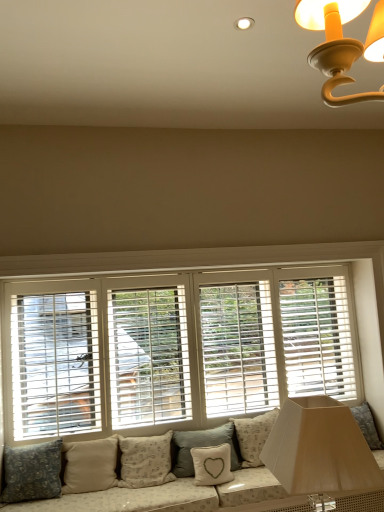
Find the location of a particular element. dark gray fabric pillow at lower left, acting as the sixth pillow starting from the right is located at coordinates (32, 472).

The image size is (384, 512). What do you see at coordinates (32, 472) in the screenshot?
I see `dark gray fabric pillow at lower left, positioned as the 1th pillow in left-to-right order` at bounding box center [32, 472].

The height and width of the screenshot is (512, 384). I want to click on white wood blinds at center, so click(176, 348).

Image resolution: width=384 pixels, height=512 pixels. What do you see at coordinates (176, 348) in the screenshot?
I see `white wood blinds at center` at bounding box center [176, 348].

What do you see at coordinates (320, 451) in the screenshot? Image resolution: width=384 pixels, height=512 pixels. I see `matte white lampshade at lower right` at bounding box center [320, 451].

The height and width of the screenshot is (512, 384). Identify the location of matte white lampshade at lower right. (320, 451).

The image size is (384, 512). Identify the location of white fabric pillow with heart design at lower center, which appears as the second pillow when viewed from the right. (212, 464).

The width and height of the screenshot is (384, 512). Describe the element at coordinates (212, 464) in the screenshot. I see `white fabric pillow with heart design at lower center, the 5th pillow positioned from the left` at that location.

Locate an element on the screen. light gray textured pillow at center, placed as the fourth pillow when sorted from left to right is located at coordinates (203, 446).

Consider the image. Is light gray textured pillow at center, arranged as the third pillow when viewed from the right, located outside fluffy white pillow at lower center, the sixth pillow in the left-to-right sequence?

light gray textured pillow at center, arranged as the third pillow when viewed from the right, is positioned outside fluffy white pillow at lower center, the sixth pillow in the left-to-right sequence.

Can you confirm if light gray textured pillow at center, placed as the fourth pillow when sorted from left to right, is smaller than fluffy white pillow at lower center, the first pillow viewed from the right?

Indeed, light gray textured pillow at center, placed as the fourth pillow when sorted from left to right, has a smaller size compared to fluffy white pillow at lower center, the first pillow viewed from the right.

From the image's perspective, between light gray textured pillow at center, placed as the fourth pillow when sorted from left to right, and fluffy white pillow at lower center, the first pillow viewed from the right, which one is located above?

fluffy white pillow at lower center, the first pillow viewed from the right, appears higher in the image.

Based on the photo, can you see light gray textured pillow at center, placed as the fourth pillow when sorted from left to right, touching fluffy white pillow at lower center, the sixth pillow in the left-to-right sequence?

No, light gray textured pillow at center, placed as the fourth pillow when sorted from left to right, is not making contact with fluffy white pillow at lower center, the sixth pillow in the left-to-right sequence.

Is matte white lampshade at lower right shorter than white wood blinds at center?

Indeed, matte white lampshade at lower right has a lesser height compared to white wood blinds at center.

Looking at the image, does matte white lampshade at lower right seem bigger or smaller compared to white wood blinds at center?

In the image, matte white lampshade at lower right appears to be smaller than white wood blinds at center.

From the image's perspective, which is below, matte white lampshade at lower right or white wood blinds at center?

white wood blinds at center.

Is point (342, 469) closer or farther from the camera than point (98, 337)?

Point (342, 469).

Considering the relative sizes of white wood blinds at center and light gray textured pillow at center, placed as the fourth pillow when sorted from left to right, in the image provided, is white wood blinds at center shorter than light gray textured pillow at center, placed as the fourth pillow when sorted from left to right,?

Incorrect, the height of white wood blinds at center does not fall short of that of light gray textured pillow at center, placed as the fourth pillow when sorted from left to right.

The image size is (384, 512). Identify the location of window above the light gray textured pillow at center, placed as the fourth pillow when sorted from left to right (from a real-world perspective). (176, 348).

Is point (334, 295) positioned before point (175, 434)?

That is False.

From the image's perspective, between white wood blinds at center and light gray textured pillow at center, arranged as the third pillow when viewed from the right, who is located below?

light gray textured pillow at center, arranged as the third pillow when viewed from the right, appears lower in the image.

Which is more to the left, white fabric pillow with heart design at lower center, which appears as the second pillow when viewed from the right, or white wood blinds at center?

white wood blinds at center is more to the left.

Looking at their sizes, would you say white fabric pillow with heart design at lower center, which appears as the second pillow when viewed from the right, is wider or thinner than white wood blinds at center?

Clearly, white fabric pillow with heart design at lower center, which appears as the second pillow when viewed from the right, has more width compared to white wood blinds at center.

Is white fabric pillow with heart design at lower center, the 5th pillow positioned from the left, aimed at white wood blinds at center?

No, white fabric pillow with heart design at lower center, the 5th pillow positioned from the left, does not turn towards white wood blinds at center.

From the image's perspective, which one is positioned higher, matte white lampshade at lower right or fluffy white pillow at lower center, the sixth pillow in the left-to-right sequence?

matte white lampshade at lower right is shown above in the image.

Where is `pillow that is on the right side of matte white lampshade at lower right`? Image resolution: width=384 pixels, height=512 pixels. pillow that is on the right side of matte white lampshade at lower right is located at coordinates (254, 436).

Is matte white lampshade at lower right oriented towards fluffy white pillow at lower center, the sixth pillow in the left-to-right sequence?

No, matte white lampshade at lower right does not turn towards fluffy white pillow at lower center, the sixth pillow in the left-to-right sequence.

Measure the distance from matte white lampshade at lower right to fluffy white pillow at lower center, the sixth pillow in the left-to-right sequence.

1.53 meters.

Is matte white lampshade at lower right facing away from beige fabric pillow at center, positioned as the 3th pillow in left-to-right order?

No, beige fabric pillow at center, positioned as the 3th pillow in left-to-right order, is not at the back of matte white lampshade at lower right.

From the image's perspective, is matte white lampshade at lower right located above or below beige fabric pillow at center, positioned as the 3th pillow in left-to-right order?

matte white lampshade at lower right is above beige fabric pillow at center, positioned as the 3th pillow in left-to-right order.

Between matte white lampshade at lower right and beige fabric pillow at center, positioned as the 3th pillow in left-to-right order, which one is positioned in front?

Positioned in front is matte white lampshade at lower right.

Looking at the image, does matte white lampshade at lower right seem bigger or smaller compared to beige fabric pillow at center, which ranks as the fourth pillow in right-to-left order?

matte white lampshade at lower right is bigger than beige fabric pillow at center, which ranks as the fourth pillow in right-to-left order.

Which is behind, point (136, 421) or point (209, 469)?

The point (136, 421) is more distant.

At what (x,y) coordinates should I click in order to perform the action: click on the 6th pillow positioned below the white wood blinds at center (from a real-world perspective). Please return your answer as a coordinate pair (x, y). The width and height of the screenshot is (384, 512). Looking at the image, I should click on (212, 464).

Is white wood blinds at center facing away from white fabric pillow with heart design at lower center, which appears as the second pillow when viewed from the right?

No, white wood blinds at center is not facing away from white fabric pillow with heart design at lower center, which appears as the second pillow when viewed from the right.

Based on their positions, is white wood blinds at center located to the left or right of white fabric pillow with heart design at lower center, which appears as the second pillow when viewed from the right?

Based on their positions, white wood blinds at center is located to the left of white fabric pillow with heart design at lower center, which appears as the second pillow when viewed from the right.

Where is `pillow behind the light gray textured pillow at center, placed as the fourth pillow when sorted from left to right`? This screenshot has height=512, width=384. pillow behind the light gray textured pillow at center, placed as the fourth pillow when sorted from left to right is located at coordinates (254, 436).

What are the coordinates of `table lamp below the white wood blinds at center (from a real-world perspective)` in the screenshot? It's located at (320, 451).

Based on their spatial positions, is white fabric pillow with heart design at lower center, which appears as the second pillow when viewed from the right, or light gray textured pillow at center, placed as the fourth pillow when sorted from left to right, further from dark gray fabric pillow at lower left, acting as the sixth pillow starting from the right?

Based on the image, white fabric pillow with heart design at lower center, which appears as the second pillow when viewed from the right, appears to be further to dark gray fabric pillow at lower left, acting as the sixth pillow starting from the right.

Based on their spatial positions, is white wood blinds at center or beige fabric pillow at lower center, marked as the 5th pillow in a right-to-left arrangement, further from fluffy white pillow at lower center, the sixth pillow in the left-to-right sequence?

beige fabric pillow at lower center, marked as the 5th pillow in a right-to-left arrangement, lies further to fluffy white pillow at lower center, the sixth pillow in the left-to-right sequence, than the other object.

When comparing their distances from fluffy white pillow at lower center, the first pillow viewed from the right, does white fabric pillow with heart design at lower center, the 5th pillow positioned from the left, or dark gray fabric pillow at lower left, acting as the sixth pillow starting from the right, seem closer?

white fabric pillow with heart design at lower center, the 5th pillow positioned from the left, is positioned closer to the anchor fluffy white pillow at lower center, the first pillow viewed from the right.

Which object lies nearer to the anchor point beige fabric pillow at lower center, which is the 2th pillow in left-to-right order, fluffy white pillow at lower center, the sixth pillow in the left-to-right sequence, or light gray textured pillow at center, arranged as the third pillow when viewed from the right?

Based on the image, light gray textured pillow at center, arranged as the third pillow when viewed from the right, appears to be nearer to beige fabric pillow at lower center, which is the 2th pillow in left-to-right order.

From the image, which object appears to be nearer to white fabric pillow with heart design at lower center, the 5th pillow positioned from the left, dark gray fabric pillow at lower left, positioned as the 1th pillow in left-to-right order, or beige fabric pillow at lower center, marked as the 5th pillow in a right-to-left arrangement?

beige fabric pillow at lower center, marked as the 5th pillow in a right-to-left arrangement, lies closer to white fabric pillow with heart design at lower center, the 5th pillow positioned from the left, than the other object.

Estimate the real-world distances between objects in this image. Which object is further from matte white lampshade at lower right, fluffy white pillow at lower center, the sixth pillow in the left-to-right sequence, or beige fabric pillow at center, which ranks as the fourth pillow in right-to-left order?

Based on the image, beige fabric pillow at center, which ranks as the fourth pillow in right-to-left order, appears to be further to matte white lampshade at lower right.

Based on their spatial positions, is beige fabric pillow at center, positioned as the 3th pillow in left-to-right order, or white fabric pillow with heart design at lower center, which appears as the second pillow when viewed from the right, further from fluffy white pillow at lower center, the sixth pillow in the left-to-right sequence?

The object further to fluffy white pillow at lower center, the sixth pillow in the left-to-right sequence, is beige fabric pillow at center, positioned as the 3th pillow in left-to-right order.

Considering their positions, is light gray textured pillow at center, arranged as the third pillow when viewed from the right, positioned further to fluffy white pillow at lower center, the sixth pillow in the left-to-right sequence, than white fabric pillow with heart design at lower center, which appears as the second pillow when viewed from the right?

Among the two, white fabric pillow with heart design at lower center, which appears as the second pillow when viewed from the right, is located further to fluffy white pillow at lower center, the sixth pillow in the left-to-right sequence.

Identify the location of window situated between beige fabric pillow at lower center, which is the 2th pillow in left-to-right order, and fluffy white pillow at lower center, the sixth pillow in the left-to-right sequence, from left to right. (176, 348).

Identify the location of pillow between beige fabric pillow at center, positioned as the 3th pillow in left-to-right order, and white fabric pillow with heart design at lower center, which appears as the second pillow when viewed from the right, in the horizontal direction. Image resolution: width=384 pixels, height=512 pixels. (203, 446).

Where is `pillow that lies between white wood blinds at center and light gray textured pillow at center, arranged as the third pillow when viewed from the right, from top to bottom`? This screenshot has width=384, height=512. pillow that lies between white wood blinds at center and light gray textured pillow at center, arranged as the third pillow when viewed from the right, from top to bottom is located at coordinates (254, 436).

Where is `window between beige fabric pillow at lower center, marked as the 5th pillow in a right-to-left arrangement, and white fabric pillow with heart design at lower center, the 5th pillow positioned from the left, in the horizontal direction`? This screenshot has width=384, height=512. window between beige fabric pillow at lower center, marked as the 5th pillow in a right-to-left arrangement, and white fabric pillow with heart design at lower center, the 5th pillow positioned from the left, in the horizontal direction is located at coordinates (176, 348).